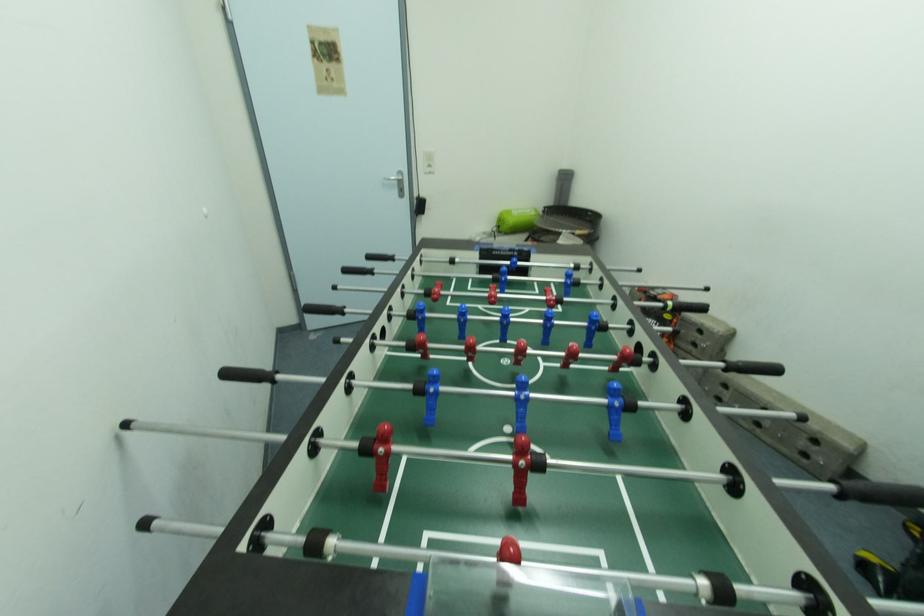
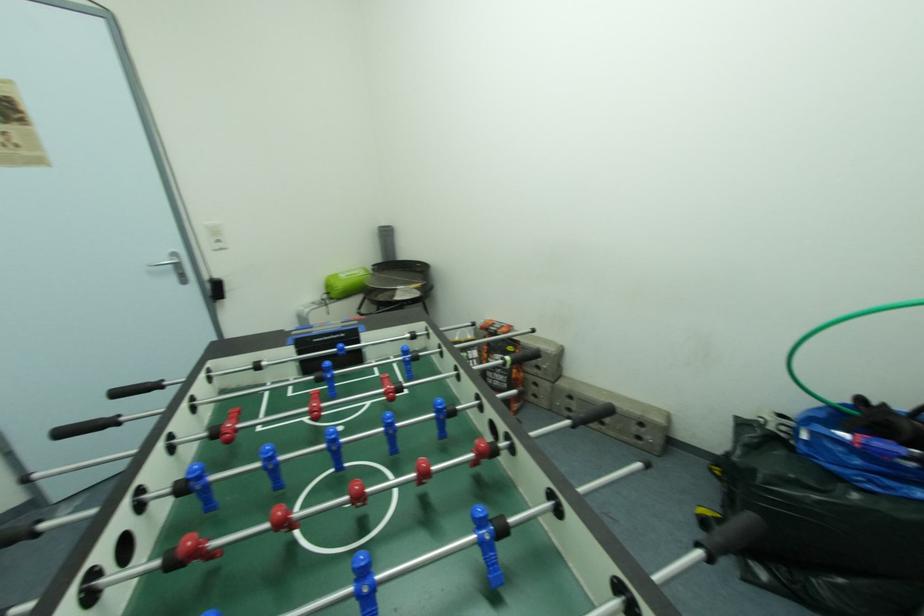
The images are taken continuously from a first-person perspective. In which direction are you moving?

The cameraman moved toward right, forward.